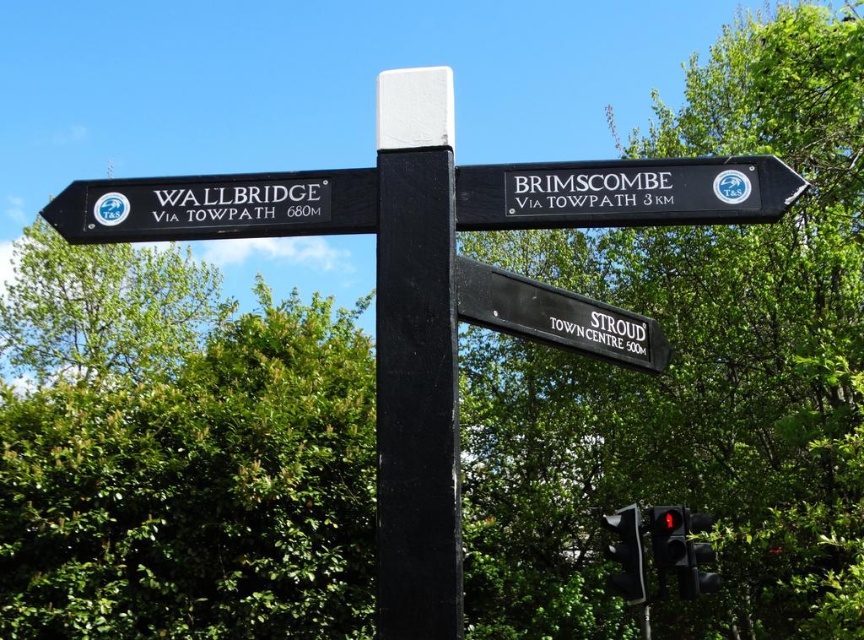
Is point (353, 214) positioned behind point (683, 508)?

No, it is not.

Between black plastic sign at left and matte black traffic light at lower right, which one has more height?

With more height is matte black traffic light at lower right.

This screenshot has width=864, height=640. Find the location of `black plastic sign at left`. black plastic sign at left is located at coordinates (216, 205).

Find the location of a particular element. The image size is (864, 640). black plastic sign at left is located at coordinates (216, 205).

Image resolution: width=864 pixels, height=640 pixels. What do you see at coordinates (624, 193) in the screenshot?
I see `black wood signpost at upper right` at bounding box center [624, 193].

Is black wood signpost at upper right to the right of red glass traffic light at lower right from the viewer's perspective?

In fact, black wood signpost at upper right is to the left of red glass traffic light at lower right.

Is point (672, 208) behind point (649, 524)?

No, it is not.

At what (x,y) coordinates should I click in order to perform the action: click on black wood signpost at upper right. Please return your answer as a coordinate pair (x, y). The height and width of the screenshot is (640, 864). Looking at the image, I should click on (624, 193).

Describe the element at coordinates (416, 358) in the screenshot. This screenshot has height=640, width=864. I see `black smooth post at center` at that location.

Does point (429, 182) come closer to viewer compared to point (656, 547)?

Yes, it is in front of point (656, 547).

Where is `black smooth post at center`? black smooth post at center is located at coordinates (416, 358).